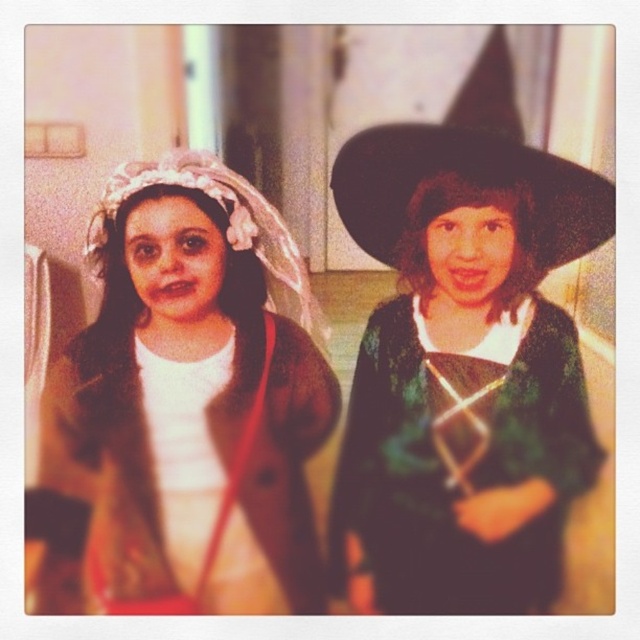
Is point (566, 420) positioned behind point (593, 173)?

No, (566, 420) is in front of (593, 173).

Does point (416, 401) lie behind point (508, 54)?

No, (416, 401) is closer to viewer.

Locate an element on the screen. The height and width of the screenshot is (640, 640). green velvet dress at right is located at coordinates (465, 472).

Between matte brown coat at center and green velvet dress at right, which one is positioned lower?

Positioned lower is green velvet dress at right.

Between point (157, 445) and point (371, 406), which one is positioned in front?

Positioned in front is point (157, 445).

I want to click on matte brown coat at center, so click(192, 401).

Which is above, matte brown coat at center or black felt witch hat at upper right?

Positioned higher is black felt witch hat at upper right.

Consider the image. Does matte brown coat at center appear under black felt witch hat at upper right?

Yes.

Between point (150, 320) and point (381, 170), which one is positioned behind?

The point (381, 170) is more distant.

Locate an element on the screen. The image size is (640, 640). matte brown coat at center is located at coordinates (192, 401).